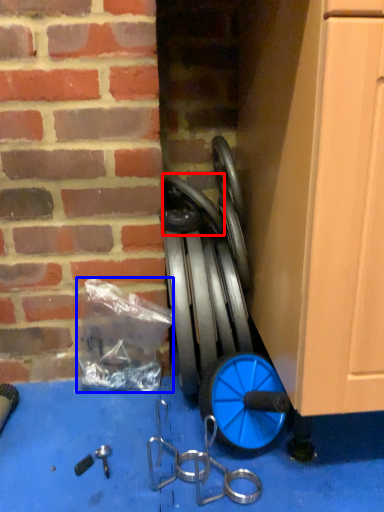
Question: Which point is closer to the camera, wheel (highlighted by a red box) or garbage (highlighted by a blue box)?

Choices:
 (A) wheel
 (B) garbage

Answer: (A)